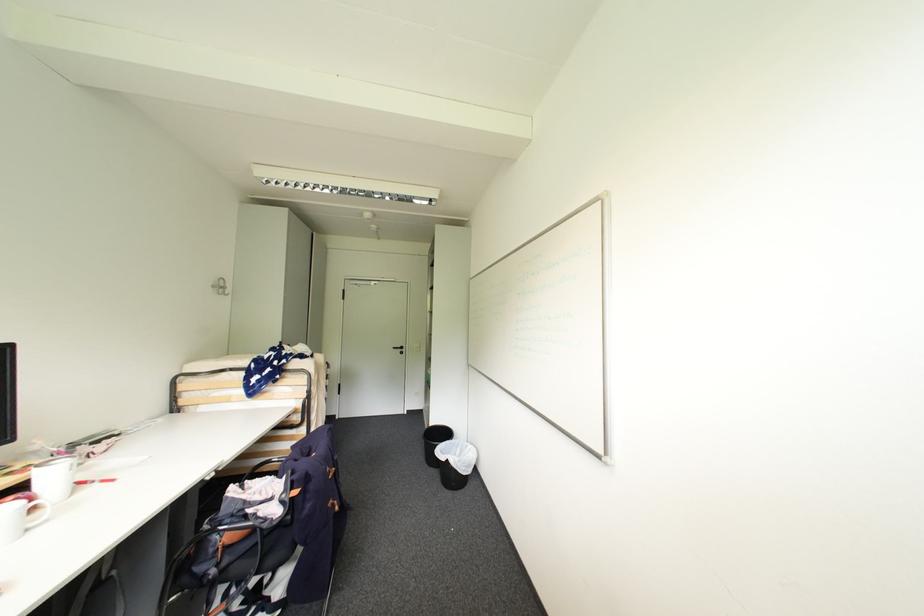
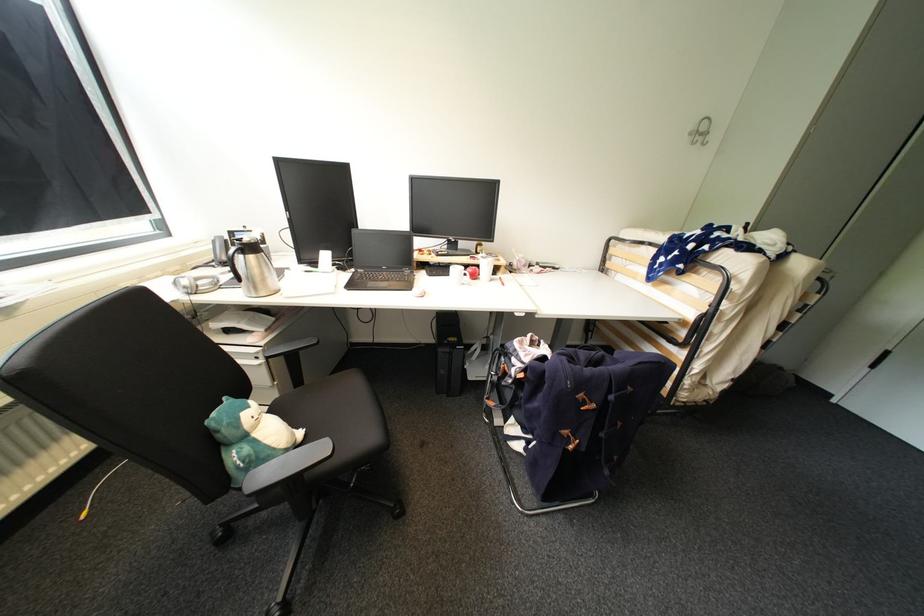
The first image is from the beginning of the video and the second image is from the end. How did the camera likely rotate when shooting the video?

The camera's rotation is toward left-down.